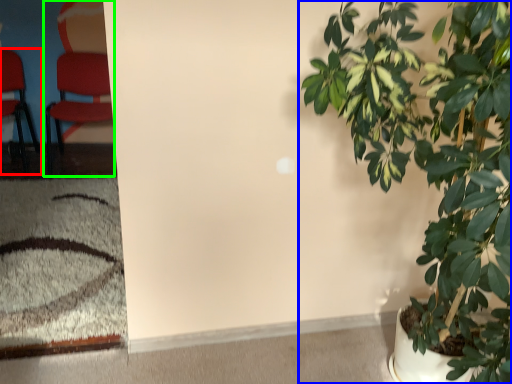
Question: Which object is the closest to the chair (highlighted by a red box)? Choose among these: houseplant (highlighted by a blue box) or chair (highlighted by a green box).

Choices:
 (A) houseplant
 (B) chair

Answer: (B)